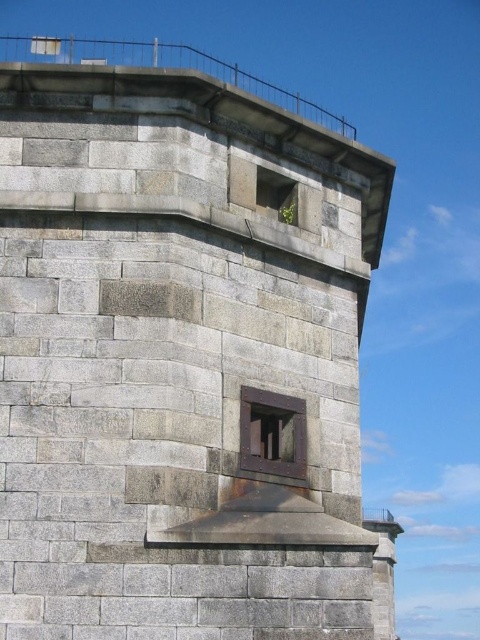
You are an architect assessing the structural integrity of the stone wall. You notice two rusty metal windows on the wall. How far apart are the rusty metal window at center and the rusty metal window at upper center?

The rusty metal window at center is 14.36 feet from the rusty metal window at upper center.

You are an architect analyzing the structural integrity of the stone wall. The rusty metal window at center is located at coordinates 0.678, 0.569. Does this placement suggest it is positioned centrally on the wall?

The rusty metal window at center is located at coordinates (273, 433), which indicates it is positioned centrally on the wall.